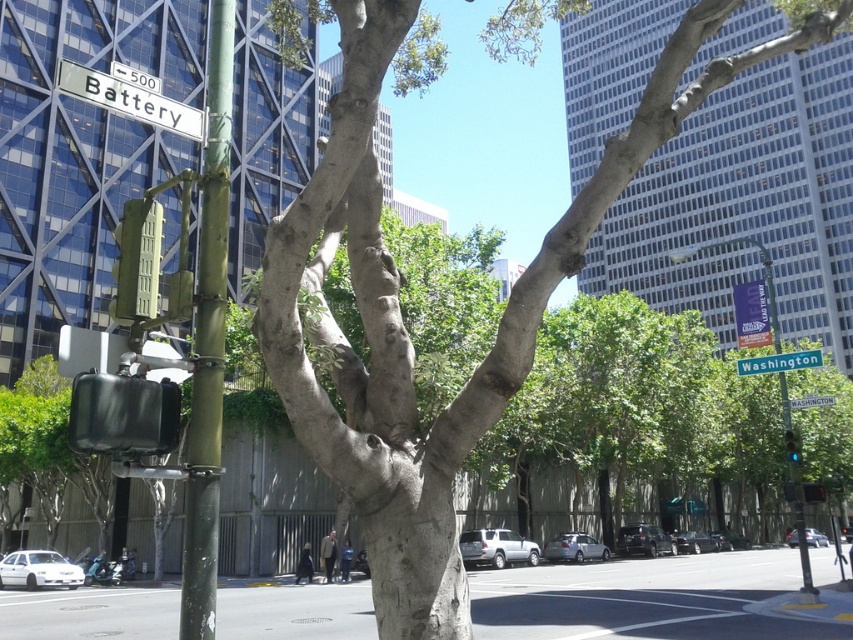
Looking at this image, does smooth gray bark at center have a lesser height compared to white matte street sign at upper left?

In fact, smooth gray bark at center may be taller than white matte street sign at upper left.

Is smooth gray bark at center below white matte street sign at upper left?

Yes, smooth gray bark at center is below white matte street sign at upper left.

Where is `smooth gray bark at center`? This screenshot has width=853, height=640. smooth gray bark at center is located at coordinates (403, 324).

Between green matte traffic light at upper left and green metallic street sign at center, which one is positioned lower?

green metallic street sign at center

From the picture: Between green matte traffic light at upper left and green metallic street sign at center, which one is positioned higher?

green matte traffic light at upper left

Locate an element on the screen. This screenshot has height=640, width=853. green matte traffic light at upper left is located at coordinates (137, 260).

Who is more distant from viewer, [399,416] or [805,401]?

The point [805,401] is behind.

Between point (354, 496) and point (805, 401), which one is positioned in front?

Positioned in front is point (354, 496).

Does point (827, 32) lie behind point (805, 404)?

No, (827, 32) is closer to viewer.

Identify the location of smooth gray bark at center. The image size is (853, 640). (403, 324).